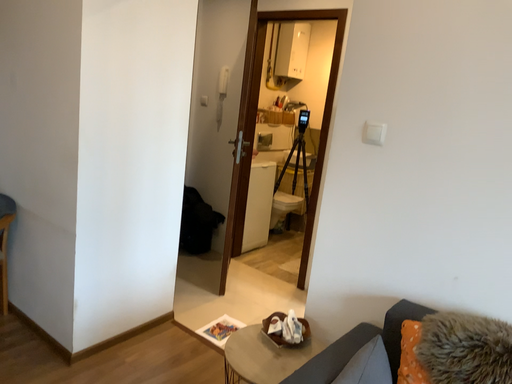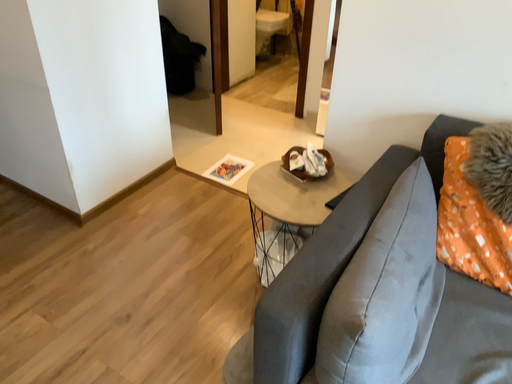
Question: How did the camera likely rotate when shooting the video?

Choices:
 (A) rotated downward
 (B) rotated upward

Answer: (A)